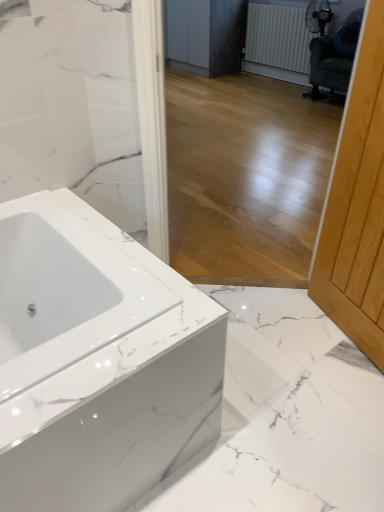
At what (x,y) coordinates should I click in order to perform the action: click on free space in front of light wood screen door at right. Please return your answer as a coordinate pair (x, y). Looking at the image, I should click on pyautogui.click(x=341, y=397).